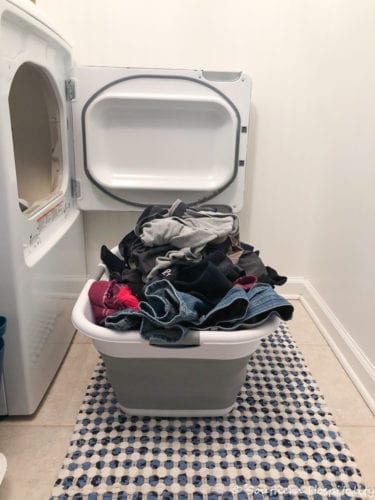
I want to click on grout lines in tile floor, so click(x=56, y=426), click(x=80, y=342), click(x=320, y=344), click(x=349, y=425).